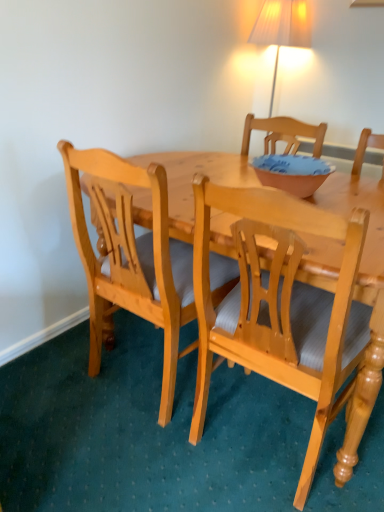
How much space does light wood chair at center, positioned as the 1th chair in right-to-left order, occupy horizontally?

The width of light wood chair at center, positioned as the 1th chair in right-to-left order, is 55.08 centimeters.

Image resolution: width=384 pixels, height=512 pixels. What do you see at coordinates (285, 310) in the screenshot?
I see `light wood chair at center, the second chair positioned from the left` at bounding box center [285, 310].

Image resolution: width=384 pixels, height=512 pixels. What do you see at coordinates (130, 257) in the screenshot?
I see `light wood chair at center, the second chair viewed from the right` at bounding box center [130, 257].

Measure the distance between point (269, 174) and camera.

The depth of point (269, 174) is 1.42 meters.

The image size is (384, 512). Find the location of `light wood chair at center, the second chair positioned from the left`. light wood chair at center, the second chair positioned from the left is located at coordinates (285, 310).

From a real-world perspective, is matte pink bowl at center positioned over light wood chair at center, the first chair positioned from the left, based on gravity?

Correct, in the physical world, matte pink bowl at center is higher than light wood chair at center, the first chair positioned from the left.

Who is bigger, matte pink bowl at center or light wood chair at center, the second chair viewed from the right?

Bigger between the two is light wood chair at center, the second chair viewed from the right.

Considering the sizes of objects matte pink bowl at center and light wood chair at center, the second chair viewed from the right, in the image provided, who is taller, matte pink bowl at center or light wood chair at center, the second chair viewed from the right,?

light wood chair at center, the second chair viewed from the right, is taller.

From the image's perspective, starting from the matte pink bowl at center, which chair is the 1st one below? Please provide its 2D coordinates.

[(130, 257)]

Can you confirm if light wood chair at center, the second chair viewed from the right, is bigger than matte pink bowl at center?

Indeed, light wood chair at center, the second chair viewed from the right, has a larger size compared to matte pink bowl at center.

Is there a large distance between light wood chair at center, the first chair positioned from the left, and matte pink bowl at center?

That's not correct — light wood chair at center, the first chair positioned from the left, is a little close to matte pink bowl at center.

Would you say light wood chair at center, the second chair viewed from the right, contains matte pink bowl at center?

Actually, matte pink bowl at center is outside light wood chair at center, the second chair viewed from the right.

From a real-world perspective, between light wood chair at center, the first chair positioned from the left, and matte pink bowl at center, who is vertically higher?

matte pink bowl at center, from a real-world perspective.

Which is closer, (158, 253) or (238, 327)?

Point (158, 253) appears to be closer to the viewer than point (238, 327).

Can you confirm if light wood chair at center, the first chair positioned from the left, is thinner than light wood chair at center, positioned as the 1th chair in right-to-left order?

Yes, light wood chair at center, the first chair positioned from the left, is thinner than light wood chair at center, positioned as the 1th chair in right-to-left order.

Considering the sizes of objects light wood chair at center, the first chair positioned from the left, and light wood chair at center, positioned as the 1th chair in right-to-left order, in the image provided, who is smaller, light wood chair at center, the first chair positioned from the left, or light wood chair at center, positioned as the 1th chair in right-to-left order,?

With smaller size is light wood chair at center, the first chair positioned from the left.

Is light wood chair at center, the second chair viewed from the right, taller or shorter than light wood chair at center, positioned as the 1th chair in right-to-left order?

In the image, light wood chair at center, the second chair viewed from the right, appears to be shorter than light wood chair at center, positioned as the 1th chair in right-to-left order.

Is light wood chair at center, the second chair positioned from the left, far away from light wood chair at center, the second chair viewed from the right?

That's not correct — light wood chair at center, the second chair positioned from the left, is a little close to light wood chair at center, the second chair viewed from the right.

From the image's perspective, is light wood chair at center, positioned as the 1th chair in right-to-left order, located above or below light wood chair at center, the first chair positioned from the left?

light wood chair at center, positioned as the 1th chair in right-to-left order, is situated lower than light wood chair at center, the first chair positioned from the left, in the image.

Would you say light wood chair at center, positioned as the 1th chair in right-to-left order, is outside light wood chair at center, the second chair viewed from the right?

That's correct, light wood chair at center, positioned as the 1th chair in right-to-left order, is outside of light wood chair at center, the second chair viewed from the right.

In terms of height, does matte pink bowl at center look taller or shorter compared to light wood chair at center, positioned as the 1th chair in right-to-left order?

In the image, matte pink bowl at center appears to be shorter than light wood chair at center, positioned as the 1th chair in right-to-left order.

Would you say light wood chair at center, positioned as the 1th chair in right-to-left order, is part of matte pink bowl at center's contents?

No, matte pink bowl at center does not contain light wood chair at center, positioned as the 1th chair in right-to-left order.

Which of these two, matte pink bowl at center or light wood chair at center, positioned as the 1th chair in right-to-left order, is bigger?

light wood chair at center, positioned as the 1th chair in right-to-left order.

Could you tell me if matte pink bowl at center is turned towards light wood chair at center, the second chair positioned from the left?

Answer: No, matte pink bowl at center is not aimed at light wood chair at center, the second chair positioned from the left.

Considering the points (371, 311) and (271, 163), which point is behind, point (371, 311) or point (271, 163)?

Positioned behind is point (271, 163).

Measure the distance between light wood chair at center, positioned as the 1th chair in right-to-left order, and matte pink bowl at center.

17.91 inches.

Who is taller, light wood chair at center, positioned as the 1th chair in right-to-left order, or matte pink bowl at center?

light wood chair at center, positioned as the 1th chair in right-to-left order, is taller.

Which of these two, light wood chair at center, the second chair positioned from the left, or matte pink bowl at center, is bigger?

Bigger between the two is light wood chair at center, the second chair positioned from the left.

This screenshot has height=512, width=384. Identify the location of bowl on the right side of light wood chair at center, the first chair positioned from the left. (292, 173).

Where is `the 1st chair in front of the matte pink bowl at center`? The height and width of the screenshot is (512, 384). the 1st chair in front of the matte pink bowl at center is located at coordinates (130, 257).

Based on the photo, looking at the image, which one is located further to matte pink bowl at center, light wood chair at center, the second chair positioned from the left, or light wood chair at center, the second chair viewed from the right?

light wood chair at center, the second chair viewed from the right, is positioned further to the anchor matte pink bowl at center.

From the picture: When comparing their distances from light wood chair at center, positioned as the 1th chair in right-to-left order, does light wood chair at center, the second chair viewed from the right, or matte pink bowl at center seem further?

The object further to light wood chair at center, positioned as the 1th chair in right-to-left order, is matte pink bowl at center.

Based on their spatial positions, is light wood chair at center, the second chair positioned from the left, or matte pink bowl at center further from light wood chair at center, the first chair positioned from the left?

matte pink bowl at center lies further to light wood chair at center, the first chair positioned from the left, than the other object.

From the image, which object appears to be nearer to light wood chair at center, the second chair positioned from the left, matte pink bowl at center or light wood chair at center, the second chair viewed from the right?

The object closer to light wood chair at center, the second chair positioned from the left, is light wood chair at center, the second chair viewed from the right.

Looking at this image, from the image, which object appears to be nearer to matte pink bowl at center, light wood chair at center, the second chair viewed from the right, or light wood chair at center, positioned as the 1th chair in right-to-left order?

light wood chair at center, positioned as the 1th chair in right-to-left order.

When comparing their distances from light wood chair at center, the first chair positioned from the left, does matte pink bowl at center or light wood chair at center, the second chair positioned from the left, seem further?

Among the two, matte pink bowl at center is located further to light wood chair at center, the first chair positioned from the left.

Where is `chair positioned between light wood chair at center, positioned as the 1th chair in right-to-left order, and matte pink bowl at center from near to far`? This screenshot has height=512, width=384. chair positioned between light wood chair at center, positioned as the 1th chair in right-to-left order, and matte pink bowl at center from near to far is located at coordinates [x=130, y=257].